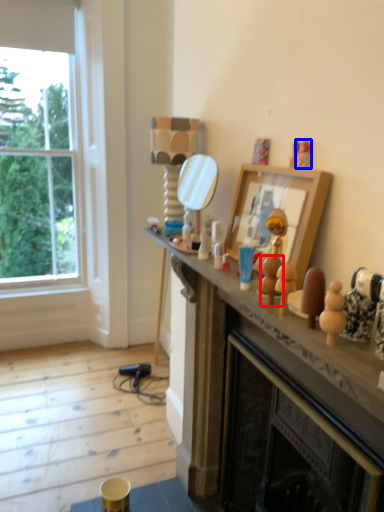
Question: Which of the following is the closest to the observer, toy (highlighted by a red box) or toy (highlighted by a blue box)?

Choices:
 (A) toy
 (B) toy

Answer: (A)